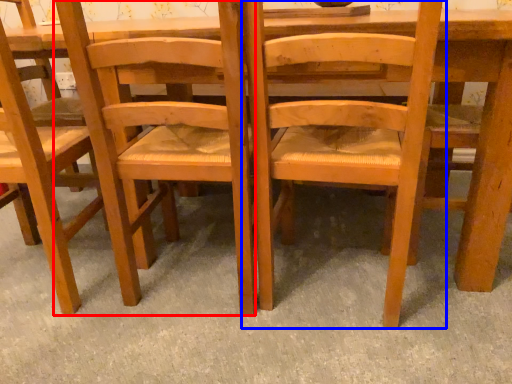
Question: Which point is further to the camera, chair (highlighted by a red box) or chair (highlighted by a blue box)?

Choices:
 (A) chair
 (B) chair

Answer: (A)